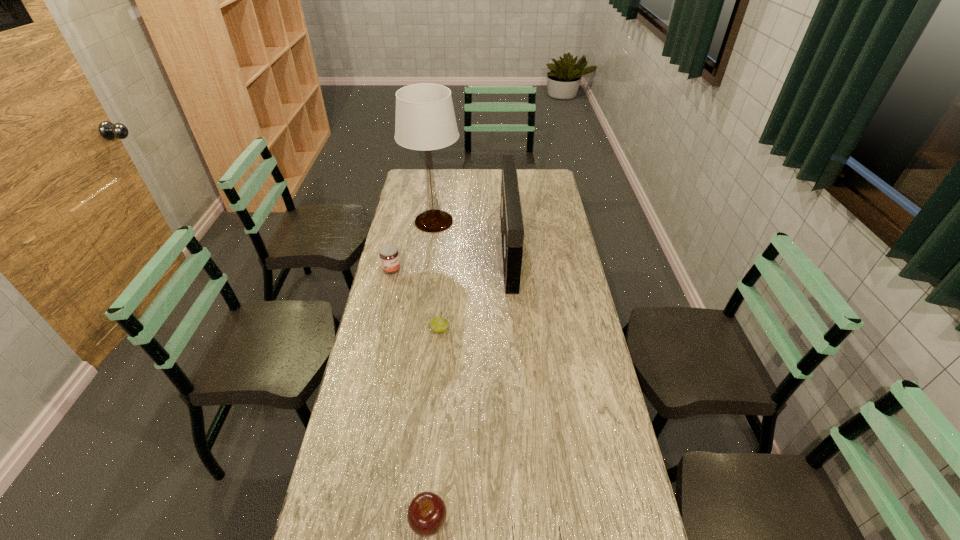
The height and width of the screenshot is (540, 960). Find the location of `the tallest object`. the tallest object is located at coordinates (425, 120).

Identify the location of the second tallest object. This screenshot has width=960, height=540. (512, 229).

At what (x,y) coordinates should I click in order to perform the action: click on jam. Please return your answer as a coordinate pair (x, y). Looking at the image, I should click on (389, 256).

The width and height of the screenshot is (960, 540). I want to click on pear, so click(x=438, y=324).

You are a GUI agent. You are given a task and a screenshot of the screen. Output one action in this format:
    pyautogui.click(x=<x>, y=<y>)
    Task: Click on the vacant space located above the cylindrical shade of the table lamp
    Image resolution: width=960 pixels, height=540 pixels.
    Given the screenshot: What is the action you would take?
    pyautogui.click(x=500, y=221)

Find the location of a particular element. This screenshot has height=540, width=960. vacant space situated 0.060m on the front side of the second tallest object is located at coordinates (489, 250).

Locate an element on the screen. vacant area located on the front side of the second tallest object is located at coordinates (431, 250).

Where is `free space located 0.150m on the front side of the second tallest object`? The height and width of the screenshot is (540, 960). free space located 0.150m on the front side of the second tallest object is located at coordinates (468, 250).

You are a GUI agent. You are given a task and a screenshot of the screen. Output one action in this format:
    pyautogui.click(x=<x>, y=<y>)
    Task: Click on the vacant space situated on the front of the jam
    Image resolution: width=960 pixels, height=540 pixels.
    Given the screenshot: What is the action you would take?
    pyautogui.click(x=383, y=306)

Where is `vacant position located on the front of the third nearest object`? vacant position located on the front of the third nearest object is located at coordinates (432, 418).